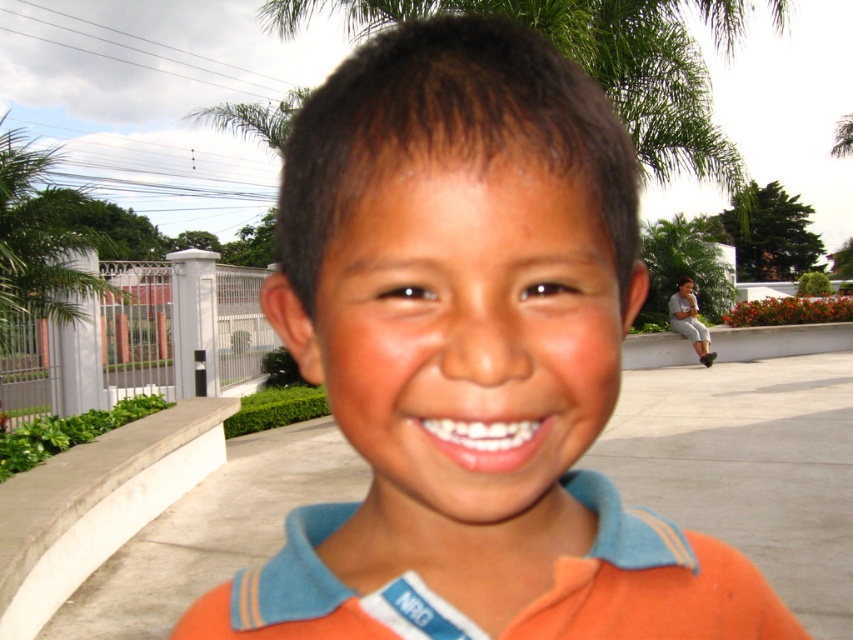
Please describe the exact location of the orange cotton polo shirt at center in the image using coordinates. The scene is a sunny outdoor setting with a young boy wearing the shirt and a white fence in the background.

The orange cotton polo shirt at center is located at coordinates point [650,580].

In the scene shown: You are taking a photo of the orange cotton shirt at center and the green leafy palm tree at upper left. Which object is positioned closer to the camera?

The orange cotton shirt at center is closer to the viewer than the green leafy palm tree at upper left, so it is positioned closer to the camera.

You are standing in the scene and want to take a photo of the boy wearing an orange polo shirt with blue collar and trim. To avoid including the palm tree in the background, where should you position yourself relative to the point represented by point (41, 241)?

To avoid including the green leafy palm tree at upper left represented by point (41, 241) in the photo, you should position yourself to the right of the point (41, 241) since the palm tree is located at that coordinate.